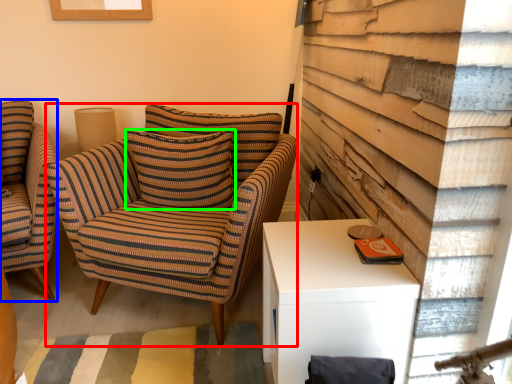
Question: Which object is the closest to the chair (highlighted by a red box)? Choose among these: chair (highlighted by a blue box) or pillow (highlighted by a green box).

Choices:
 (A) chair
 (B) pillow

Answer: (B)